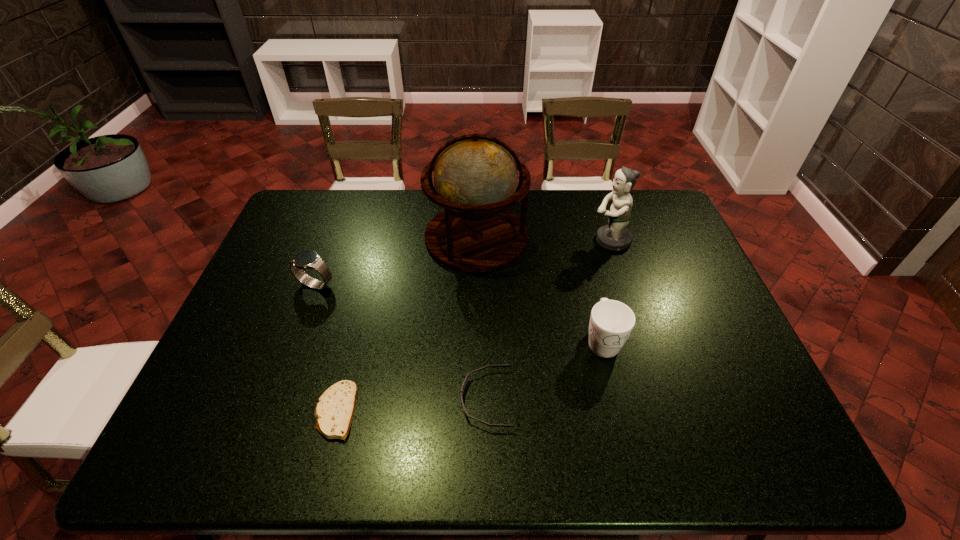
Where is `the tallest object`? This screenshot has height=540, width=960. the tallest object is located at coordinates (475, 176).

Find the location of `figurine`. figurine is located at coordinates point(615,236).

Where is `mug`? mug is located at coordinates (611, 322).

Locate an element on the screen. The height and width of the screenshot is (540, 960). watch is located at coordinates (308, 259).

The image size is (960, 540). In order to click on the third farthest object in this screenshot , I will do `click(308, 259)`.

The height and width of the screenshot is (540, 960). In order to click on sunglasses in this screenshot , I will do `click(465, 412)`.

In order to click on the second object from left to right in this screenshot , I will do `click(334, 411)`.

Where is `the shortest object`? the shortest object is located at coordinates (334, 411).

Identify the location of vacant space located on the front-facing side of the globe. (593, 238).

Where is `vacant space located on the front-facing side of the figurine`? This screenshot has height=540, width=960. vacant space located on the front-facing side of the figurine is located at coordinates (490, 240).